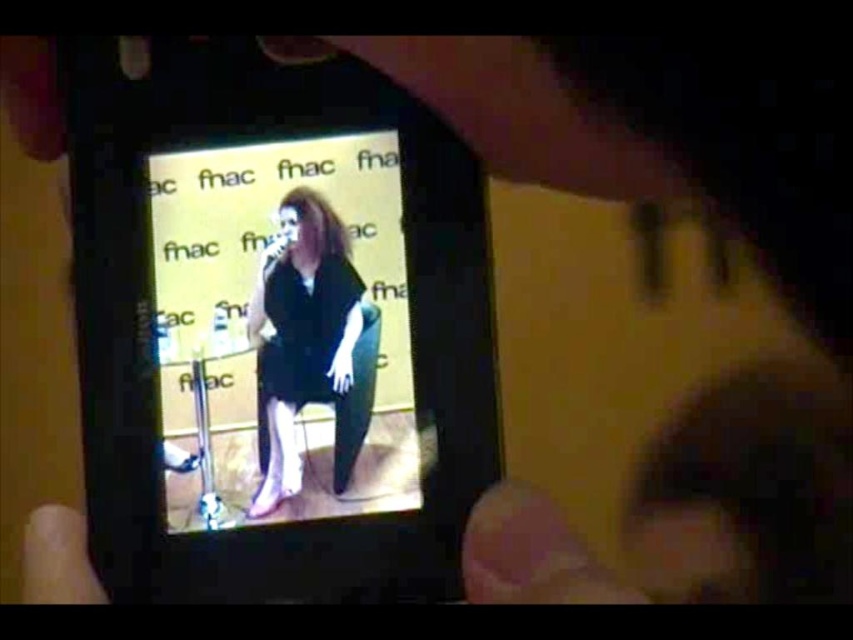
Is point (328, 264) in front of point (56, 525)?

No, (328, 264) is behind (56, 525).

Can you confirm if matte black dress at center is bigger than smooth skin hand at lower left?

Yes.

Is point (286, 282) less distant than point (57, 580)?

No, (286, 282) is further to viewer.

This screenshot has height=640, width=853. What are the coordinates of `matte black dress at center` in the screenshot? It's located at (309, 344).